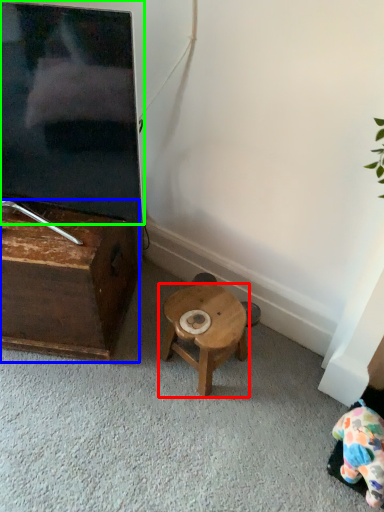
Question: Considering the real-world distances, which object is closest to stool (highlighted by a red box)? table (highlighted by a blue box) or television (highlighted by a green box).

Choices:
 (A) table
 (B) television

Answer: (A)